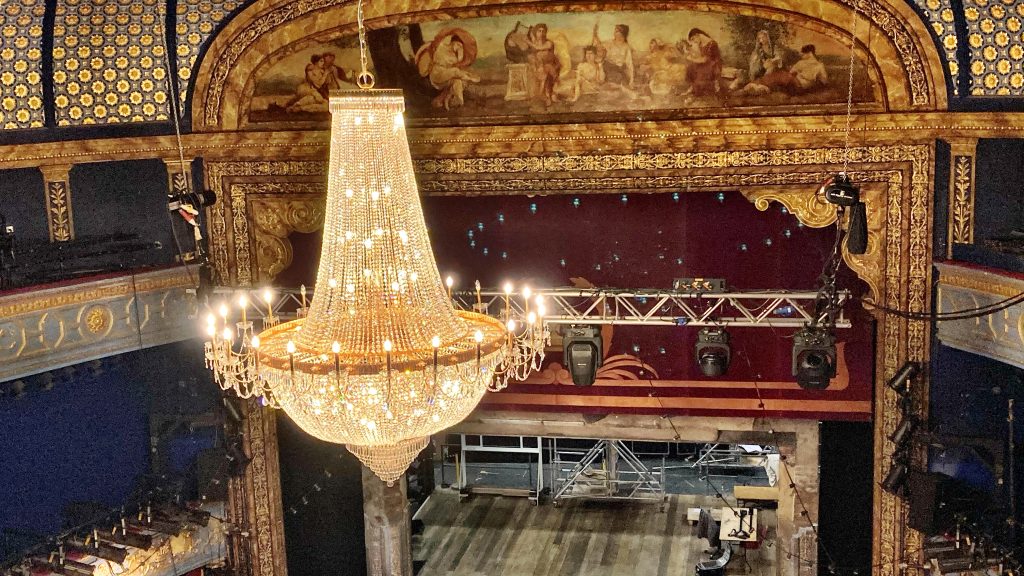
Where is `big chandelier`? The width and height of the screenshot is (1024, 576). big chandelier is located at coordinates (343, 405), (356, 196), (422, 371).